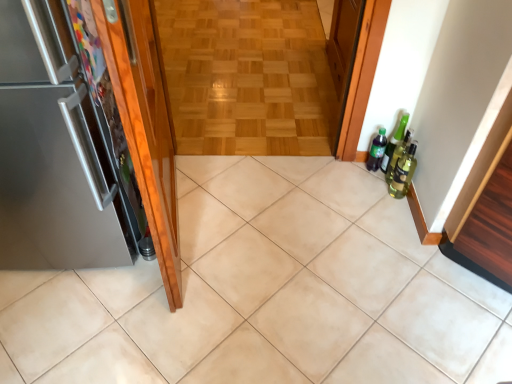
Identify the location of free space that is to the left of wooden cabinet at right. This screenshot has height=384, width=512. (402, 292).